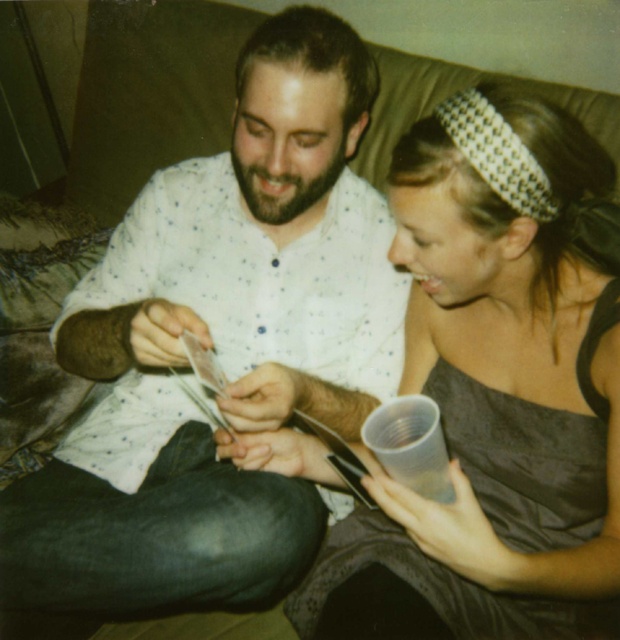
Question: Can you confirm if white dotted shirt at center is bigger than matte gray dress at center?

Choices:
 (A) no
 (B) yes

Answer: (B)

Question: Which point is closer to the camera?

Choices:
 (A) matte gray dress at center
 (B) white dotted shirt at center

Answer: (A)

Question: Is white dotted shirt at center thinner than matte gray dress at center?

Choices:
 (A) yes
 (B) no

Answer: (B)

Question: Is white dotted shirt at center wider than matte gray dress at center?

Choices:
 (A) yes
 (B) no

Answer: (A)

Question: Which point is farther to the camera?

Choices:
 (A) (538, 170)
 (B) (151, 260)

Answer: (B)